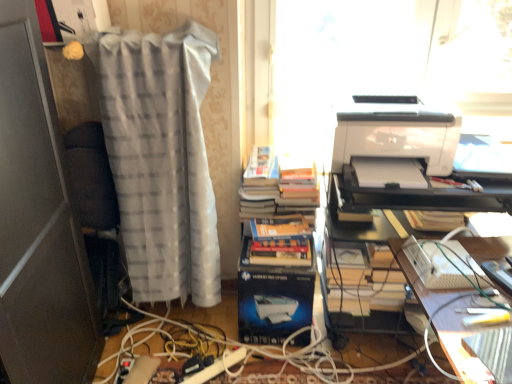
Locate an element on the screen. The height and width of the screenshot is (384, 512). free location to the left of blue glossy paperback book at center is located at coordinates (211, 336).